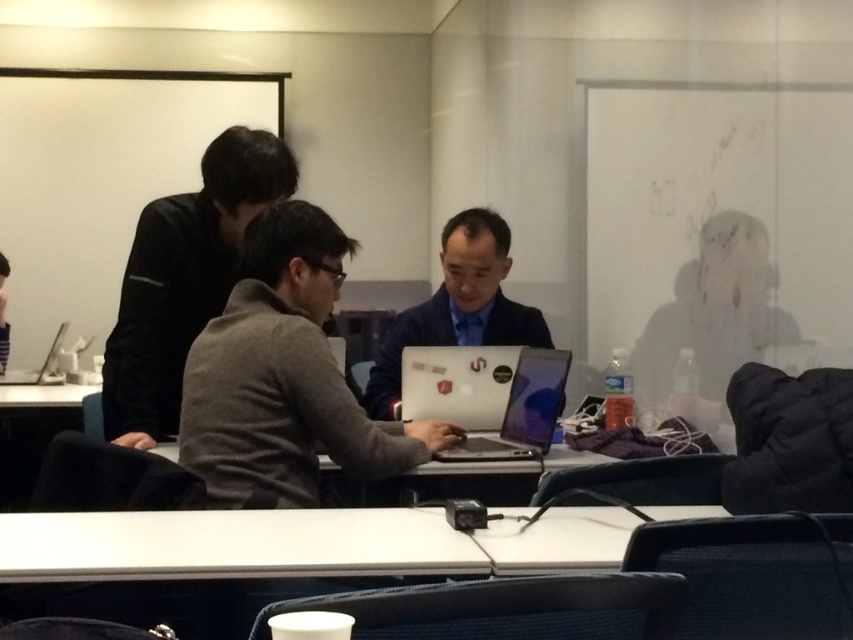
How distant is matte black jacket at right from satin black laptop at center?

26.91 inches

Looking at this image, between matte black jacket at right and satin black laptop at center, which one is positioned lower?

satin black laptop at center is below.

Is point (722, 344) less distant than point (520, 376)?

No, it is not.

Find the location of a particular element. The height and width of the screenshot is (640, 853). matte black jacket at right is located at coordinates (712, 316).

In the scene shown: Can you confirm if black matte jacket at upper left is shorter than satin black laptop at center?

No.

Is point (238, 234) behind point (544, 438)?

That is True.

The width and height of the screenshot is (853, 640). I want to click on black matte jacket at upper left, so click(183, 280).

Can you confirm if gray sweater at center is positioned below black matte jacket at upper left?

Indeed, gray sweater at center is positioned under black matte jacket at upper left.

Who is more forward, (215,445) or (288,170)?

Point (215,445) is more forward.

What do you see at coordinates (283, 378) in the screenshot? I see `gray sweater at center` at bounding box center [283, 378].

Locate an element on the screen. gray sweater at center is located at coordinates (283, 378).